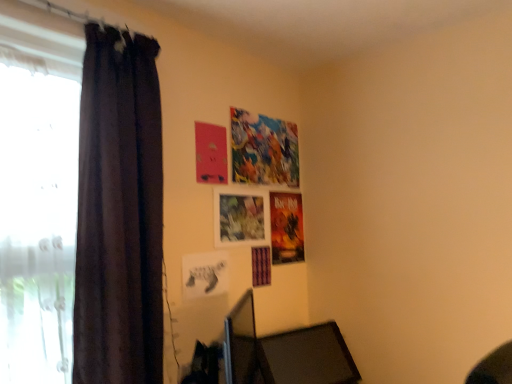
Question: Can you confirm if dark fabric curtain at left is taller than white sheer curtain at left?

Choices:
 (A) yes
 (B) no

Answer: (A)

Question: From a real-world perspective, is dark fabric curtain at left over white sheer curtain at left?

Choices:
 (A) yes
 (B) no

Answer: (A)

Question: Is dark fabric curtain at left located outside white sheer curtain at left?

Choices:
 (A) yes
 (B) no

Answer: (B)

Question: Can you confirm if dark fabric curtain at left is smaller than white sheer curtain at left?

Choices:
 (A) yes
 (B) no

Answer: (A)

Question: Is dark fabric curtain at left shorter than white sheer curtain at left?

Choices:
 (A) no
 (B) yes

Answer: (A)

Question: From the image's perspective, is dark fabric curtain at left above white sheer curtain at left?

Choices:
 (A) no
 (B) yes

Answer: (B)

Question: Could dark fabric curtain at left be considered to be inside black matte picture frame at center?

Choices:
 (A) no
 (B) yes

Answer: (A)

Question: Is black matte picture frame at center wider than dark fabric curtain at left?

Choices:
 (A) yes
 (B) no

Answer: (B)

Question: Does black matte picture frame at center have a lesser height compared to dark fabric curtain at left?

Choices:
 (A) yes
 (B) no

Answer: (A)

Question: From a real-world perspective, is black matte picture frame at center located beneath dark fabric curtain at left?

Choices:
 (A) yes
 (B) no

Answer: (A)

Question: Does black matte picture frame at center have a greater height compared to dark fabric curtain at left?

Choices:
 (A) yes
 (B) no

Answer: (B)

Question: Can you confirm if black matte picture frame at center is smaller than dark fabric curtain at left?

Choices:
 (A) yes
 (B) no

Answer: (A)

Question: Considering the relative sizes of dark fabric curtain at left and matte paper poster at upper center in the image provided, is dark fabric curtain at left thinner than matte paper poster at upper center?

Choices:
 (A) yes
 (B) no

Answer: (B)